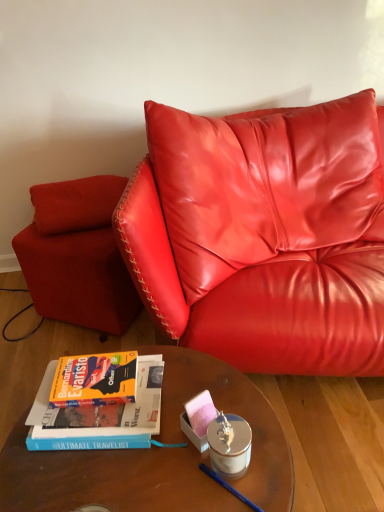
Question: Is matte red armchair at lower left a part of silver metallic candle holder at center?

Choices:
 (A) no
 (B) yes

Answer: (A)

Question: Are silver metallic candle holder at center and matte red armchair at lower left far apart?

Choices:
 (A) yes
 (B) no

Answer: (B)

Question: Considering the relative positions of silver metallic candle holder at center and matte red armchair at lower left in the image provided, is silver metallic candle holder at center to the right of matte red armchair at lower left from the viewer's perspective?

Choices:
 (A) no
 (B) yes

Answer: (B)

Question: From the image's perspective, is silver metallic candle holder at center located above matte red armchair at lower left?

Choices:
 (A) yes
 (B) no

Answer: (B)

Question: From a real-world perspective, is silver metallic candle holder at center located beneath matte red armchair at lower left?

Choices:
 (A) yes
 (B) no

Answer: (B)

Question: Can you confirm if silver metallic candle holder at center is shorter than matte red armchair at lower left?

Choices:
 (A) yes
 (B) no

Answer: (A)

Question: Can hardcover book at lower left be found inside silver metallic candle holder at center?

Choices:
 (A) no
 (B) yes

Answer: (A)

Question: Is silver metallic candle holder at center at the right side of hardcover book at lower left?

Choices:
 (A) no
 (B) yes

Answer: (B)

Question: Is silver metallic candle holder at center thinner than hardcover book at lower left?

Choices:
 (A) no
 (B) yes

Answer: (B)

Question: Is silver metallic candle holder at center far away from hardcover book at lower left?

Choices:
 (A) no
 (B) yes

Answer: (A)

Question: Is silver metallic candle holder at center closer to camera compared to hardcover book at lower left?

Choices:
 (A) no
 (B) yes

Answer: (B)

Question: Is silver metallic candle holder at center touching hardcover book at lower left?

Choices:
 (A) no
 (B) yes

Answer: (A)

Question: Can you confirm if silver metallic candle holder at center is thinner than wooden glass table at center?

Choices:
 (A) no
 (B) yes

Answer: (B)